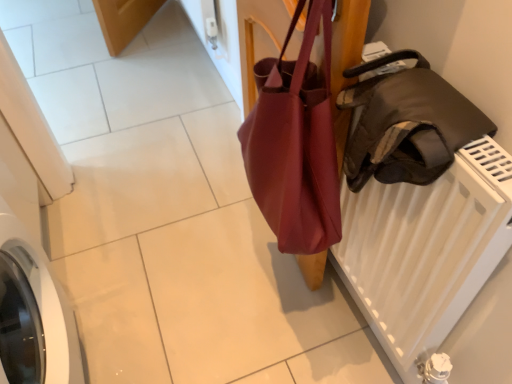
What do you see at coordinates (406, 123) in the screenshot? I see `leather jacket at right` at bounding box center [406, 123].

The width and height of the screenshot is (512, 384). Find the location of `leather jacket at right`. leather jacket at right is located at coordinates (406, 123).

What do you see at coordinates (295, 143) in the screenshot?
I see `matte brown bag at center` at bounding box center [295, 143].

Locate an element on the screen. This screenshot has height=384, width=512. matte brown bag at center is located at coordinates (295, 143).

I want to click on leather jacket at right, so click(406, 123).

Which object is positioned more to the right, leather jacket at right or matte brown bag at center?

leather jacket at right.

In the image, is leather jacket at right positioned in front of or behind matte brown bag at center?

leather jacket at right is in front of matte brown bag at center.

Is point (419, 84) behind point (302, 55)?

No.

From the image's perspective, does leather jacket at right appear higher than matte brown bag at center?

No, from the image's perspective, leather jacket at right is not over matte brown bag at center.

From a real-world perspective, relative to matte brown bag at center, is leather jacket at right vertically above or below?

In terms of real-world spatial position, leather jacket at right is above matte brown bag at center.

Considering the relative sizes of leather jacket at right and matte brown bag at center in the image provided, is leather jacket at right wider than matte brown bag at center?

Indeed, leather jacket at right has a greater width compared to matte brown bag at center.

Is leather jacket at right taller than matte brown bag at center?

No, leather jacket at right is not taller than matte brown bag at center.

Considering the sizes of objects leather jacket at right and matte brown bag at center in the image provided, who is smaller, leather jacket at right or matte brown bag at center?

Smaller between the two is leather jacket at right.

Can matte brown bag at center be found inside leather jacket at right?

No, matte brown bag at center is not a part of leather jacket at right.

Can you see leather jacket at right touching matte brown bag at center?

No, leather jacket at right is not making contact with matte brown bag at center.

Is leather jacket at right facing towards matte brown bag at center?

No.

How much distance is there between leather jacket at right and matte brown bag at center?

5.41 inches.

You are a GUI agent. You are given a task and a screenshot of the screen. Output one action in this format:
    pyautogui.click(x=<x>, y=<y>)
    Task: Click on the handbag located on the left of leather jacket at right
    The image size is (512, 384).
    Given the screenshot: What is the action you would take?
    pyautogui.click(x=295, y=143)

Is matte brown bag at center at the right side of leather jacket at right?

In fact, matte brown bag at center is to the left of leather jacket at right.

In the image, is matte brown bag at center positioned in front of or behind leather jacket at right?

In the image, matte brown bag at center appears behind leather jacket at right.

Is point (274, 92) closer or farther from the camera than point (422, 101)?

Clearly, point (274, 92) is more distant from the camera than point (422, 101).

From the image's perspective, is matte brown bag at center positioned above or below leather jacket at right?

matte brown bag at center is above leather jacket at right.

From a real-world perspective, which object stands above the other?

leather jacket at right.

From the picture: Between matte brown bag at center and leather jacket at right, which one has larger width?

leather jacket at right.

Can you confirm if matte brown bag at center is taller than leather jacket at right?

Correct, matte brown bag at center is much taller as leather jacket at right.

Consider the image. Between matte brown bag at center and leather jacket at right, which one has smaller size?

With smaller size is leather jacket at right.

Does matte brown bag at center contain leather jacket at right?

Definitely not — leather jacket at right is not inside matte brown bag at center.

Are matte brown bag at center and leather jacket at right beside each other?

matte brown bag at center and leather jacket at right are clearly separated.

Is matte brown bag at center looking in the opposite direction of leather jacket at right?

No, leather jacket at right is not at the back of matte brown bag at center.

How many degrees apart are the facing directions of matte brown bag at center and leather jacket at right?

The angular difference between matte brown bag at center and leather jacket at right is 1.45 degrees.

Where is `handbag behind the leather jacket at right`? handbag behind the leather jacket at right is located at coordinates (295, 143).

Find the location of a particular element. The image size is (512, 384). luggage and bags that is above the matte brown bag at center (from a real-world perspective) is located at coordinates (406, 123).

Find the location of a particular element. The height and width of the screenshot is (384, 512). luggage and bags in front of the matte brown bag at center is located at coordinates (406, 123).